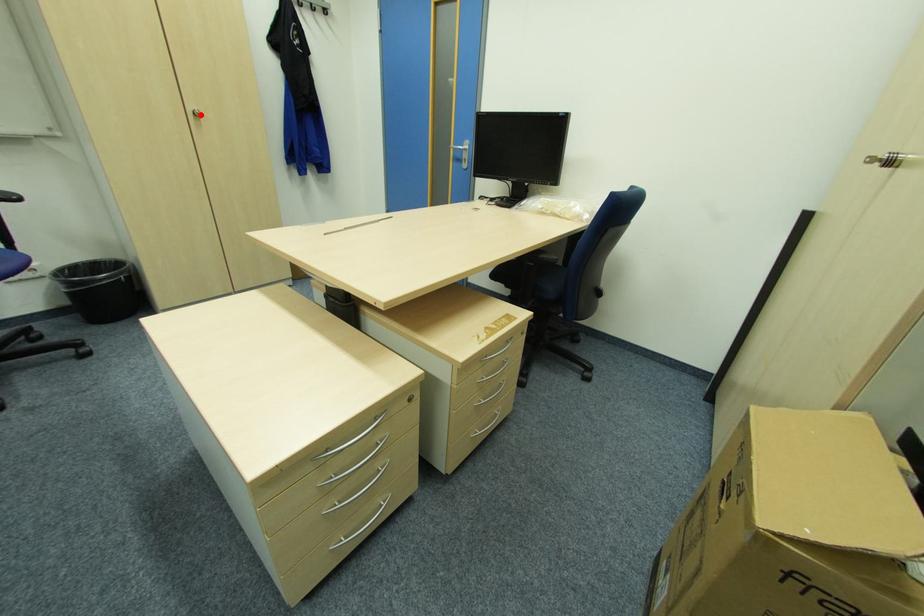
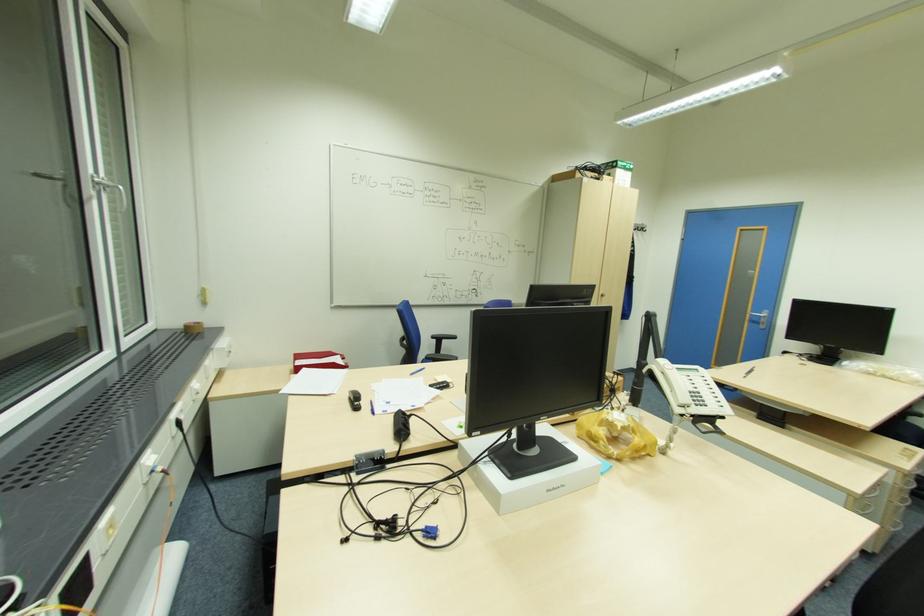
Question: I am providing you with two images of the same scene from different viewpoints. In image1, a red point is highlighted. Considering the same 3D point in image2, which of the following is correct?

Choices:
 (A) It is closer
 (B) It is farther

Answer: (B)